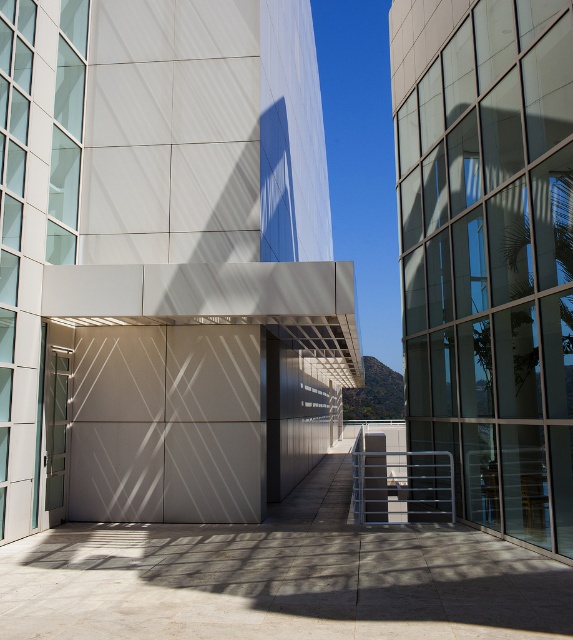
Based on the photo, you are a delivery person approaching the building and need to locate the entrance. Based on the scene, which object is positioned lower and closer to the ground between the black metal balustrade at lower center and the translucent glass door at center?

The black metal balustrade at lower center is located below the translucent glass door at center, so it is positioned lower and closer to the ground.

You are standing on the walkway and see two points marked in the image. Which point is closer to you, point (x=422, y=484) or point (x=61, y=499)?

Point (x=422, y=484) is closer to you because it is further to the viewer than point (x=61, y=499).